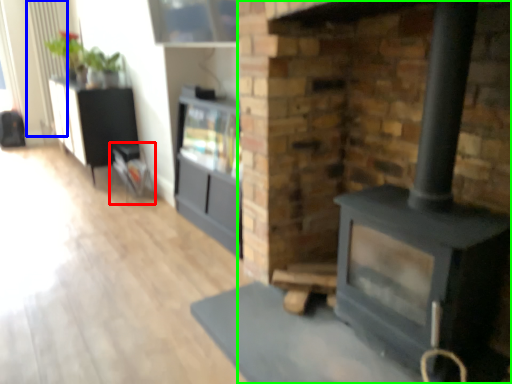
Question: Which is nearer to the furniture (highlighted by a red box)? radiator (highlighted by a blue box) or fireplace (highlighted by a green box).

Choices:
 (A) radiator
 (B) fireplace

Answer: (B)